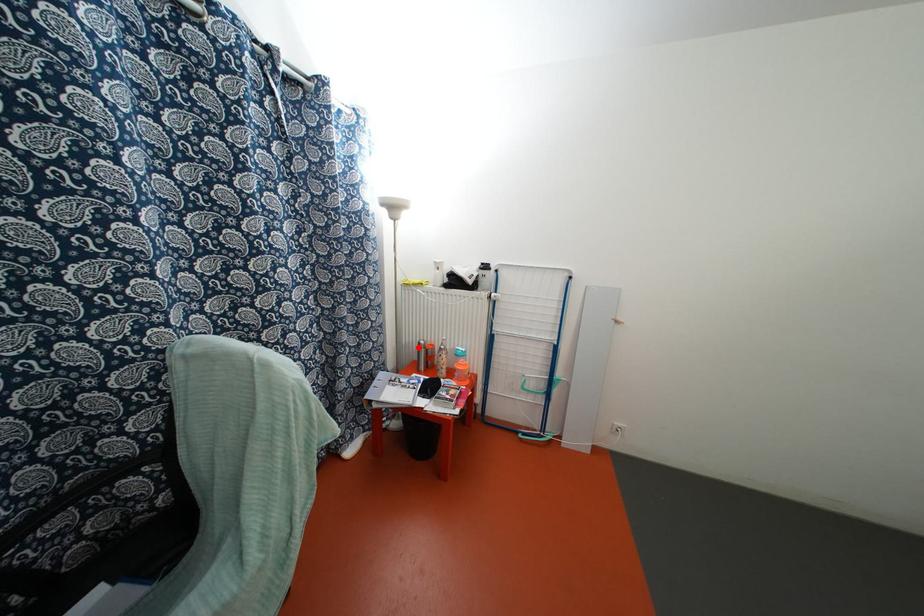
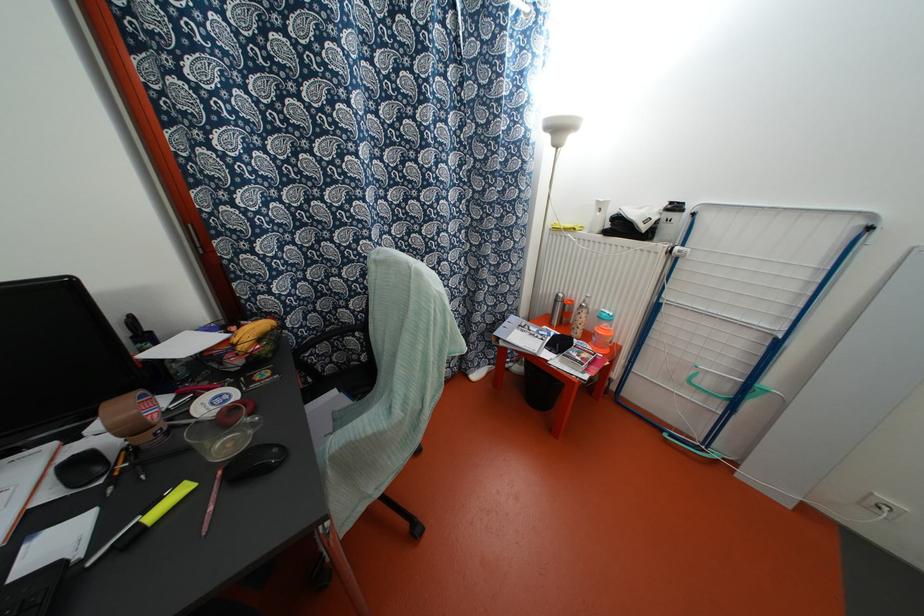
Question: I am providing you with two images of the same scene from different viewpoints. A red point is shown in image1. For the corresponding object point in image2, is it positioned nearer or farther from the camera?

Choices:
 (A) Nearer
 (B) Farther

Answer: (A)